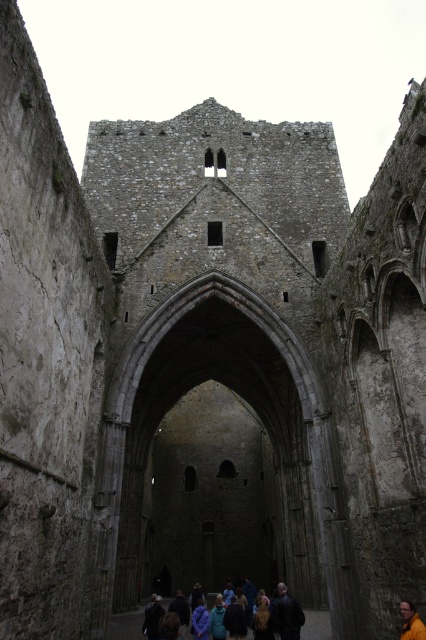
Question: Which object appears closest to the camera in this image?

Choices:
 (A) yellow fabric person at center
 (B) dark blue jacket at lower center

Answer: (A)

Question: Does dark blue jacket at lower center appear on the left side of dark brown leather jacket at center?

Choices:
 (A) yes
 (B) no

Answer: (A)

Question: Does dark blue jacket at lower center have a greater width compared to yellow fabric person at center?

Choices:
 (A) no
 (B) yes

Answer: (B)

Question: Does dark blue jacket at lower center have a greater width compared to yellow fabric person at center?

Choices:
 (A) no
 (B) yes

Answer: (B)

Question: Which object is closer to the camera taking this photo?

Choices:
 (A) yellow fabric person at center
 (B) dark blue jacket at lower center

Answer: (A)

Question: Which point is closer to the camera taking this photo?

Choices:
 (A) (161, 605)
 (B) (400, 605)

Answer: (B)